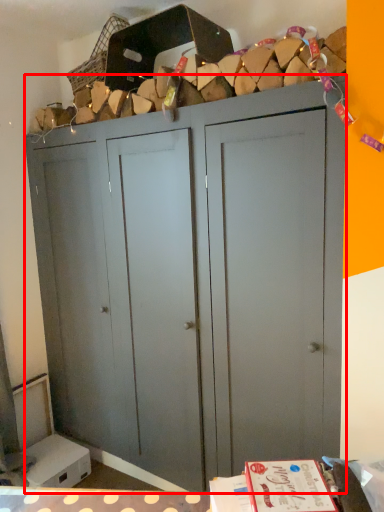
Question: From the image's perspective, where is cupboard (annotated by the red box) located relative to basket?

Choices:
 (A) below
 (B) above

Answer: (A)